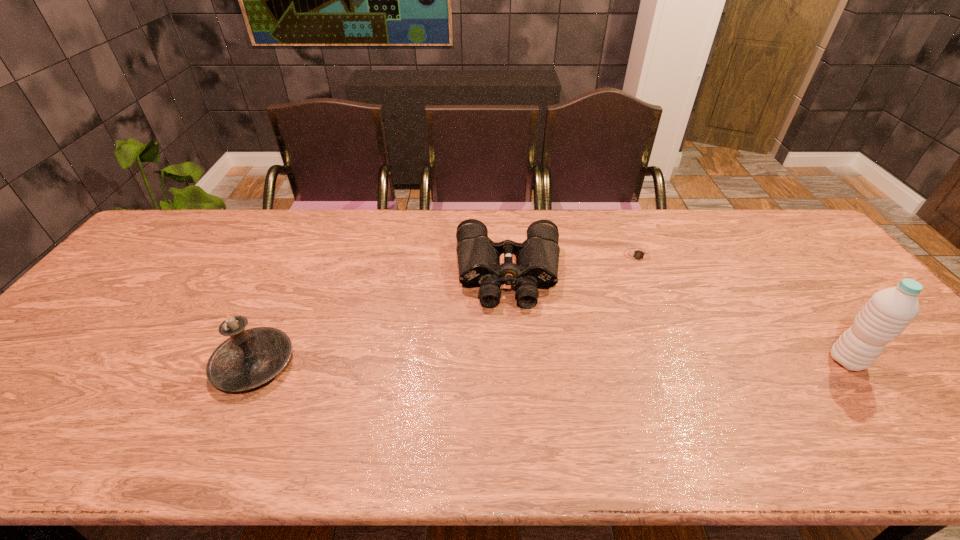
Locate an element on the screen. This screenshot has height=540, width=960. free space located 0.300m through the eyepieces of the third object from right to left is located at coordinates (516, 408).

Locate an element on the screen. free space located through the eyepieces of the third object from right to left is located at coordinates (514, 351).

Where is `vacant space located through the eyepieces of the third object from right to left`? vacant space located through the eyepieces of the third object from right to left is located at coordinates (517, 416).

In order to click on vacant space situated 0.080m on the face of the third object from left to right in this screenshot , I will do `click(635, 284)`.

Locate an element on the screen. The height and width of the screenshot is (540, 960). vacant space located on the face of the third object from left to right is located at coordinates (631, 309).

Where is `free space located on the face of the third object from left to right`? free space located on the face of the third object from left to right is located at coordinates (625, 350).

You are a GUI agent. You are given a task and a screenshot of the screen. Output one action in this format:
    pyautogui.click(x=<x>, y=<y>)
    Task: Click on the binoculars that is at the far edge
    This screenshot has height=540, width=960.
    Given the screenshot: What is the action you would take?
    pyautogui.click(x=537, y=258)

Locate an element on the screen. This screenshot has width=960, height=540. watch present at the far edge is located at coordinates (637, 254).

This screenshot has height=540, width=960. What are the coordinates of `object at the near edge` in the screenshot? It's located at (249, 358).

Locate an element on the screen. This screenshot has height=540, width=960. object that is at the right edge is located at coordinates (888, 312).